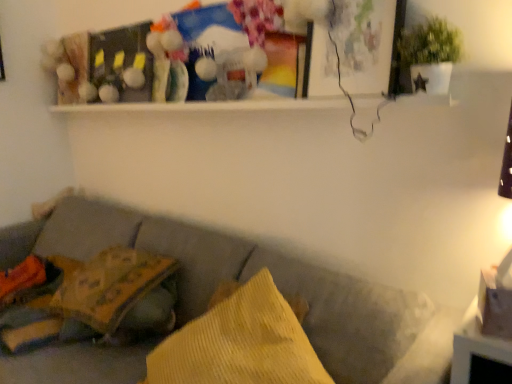
Question: From a real-world perspective, is green matte plant at upper right located higher than textured gray couch at lower left?

Choices:
 (A) no
 (B) yes

Answer: (B)

Question: Considering the relative sizes of green matte plant at upper right and textured gray couch at lower left in the image provided, is green matte plant at upper right taller than textured gray couch at lower left?

Choices:
 (A) no
 (B) yes

Answer: (A)

Question: Is green matte plant at upper right not within textured gray couch at lower left?

Choices:
 (A) no
 (B) yes

Answer: (B)

Question: Is green matte plant at upper right shorter than textured gray couch at lower left?

Choices:
 (A) yes
 (B) no

Answer: (A)

Question: Is green matte plant at upper right at the right side of textured gray couch at lower left?

Choices:
 (A) yes
 (B) no

Answer: (A)

Question: Is textured gray couch at lower left located within green matte plant at upper right?

Choices:
 (A) yes
 (B) no

Answer: (B)

Question: Can you confirm if green matte plant at upper right is bigger than yellow corduroy pillow at lower left, arranged as the second pillow when viewed from the front?

Choices:
 (A) yes
 (B) no

Answer: (B)

Question: Does green matte plant at upper right have a greater height compared to yellow corduroy pillow at lower left, which appears as the 2th pillow when viewed from the right?

Choices:
 (A) no
 (B) yes

Answer: (B)

Question: Can we say green matte plant at upper right lies outside yellow corduroy pillow at lower left, acting as the 1th pillow starting from the back?

Choices:
 (A) no
 (B) yes

Answer: (B)

Question: Is green matte plant at upper right further to the viewer compared to yellow corduroy pillow at lower left, acting as the 1th pillow starting from the back?

Choices:
 (A) no
 (B) yes

Answer: (A)

Question: From the image's perspective, does green matte plant at upper right appear lower than yellow corduroy pillow at lower left, which appears as the 2th pillow when viewed from the right?

Choices:
 (A) yes
 (B) no

Answer: (B)

Question: From a real-world perspective, is green matte plant at upper right located higher than yellow corduroy pillow at lower left, arranged as the second pillow when viewed from the front?

Choices:
 (A) yes
 (B) no

Answer: (A)

Question: From a real-world perspective, is yellow corduroy pillow at lower left, arranged as the second pillow when viewed from the front, located higher than yellow corduroy pillow at center, which appears as the first pillow when viewed from the front?

Choices:
 (A) no
 (B) yes

Answer: (A)